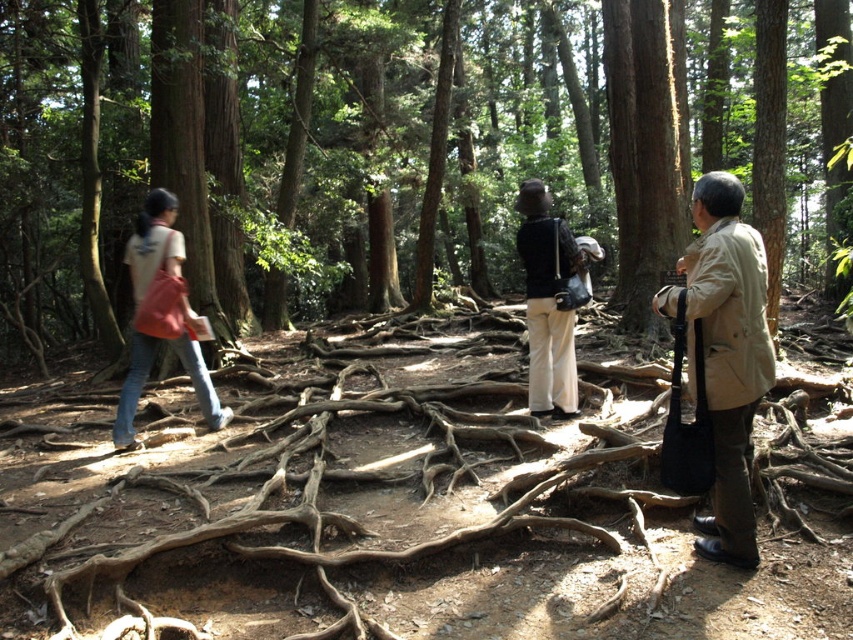
Question: Which of the following is the farthest from the observer?

Choices:
 (A) (575, 385)
 (B) (704, 538)

Answer: (A)

Question: Among these points, which one is nearest to the camera?

Choices:
 (A) (560, 364)
 (B) (717, 97)
 (C) (720, 452)
 (D) (155, 262)

Answer: (C)

Question: Does brown wood tree at center appear over beige fabric trench coat at right?

Choices:
 (A) yes
 (B) no

Answer: (A)

Question: Which object appears closest to the camera in this image?

Choices:
 (A) beige fabric trench coat at right
 (B) brown wood tree at center
 (C) matte black jacket at center

Answer: (A)

Question: Is brown wood tree at center thinner than beige fabric trench coat at right?

Choices:
 (A) no
 (B) yes

Answer: (A)

Question: Does brown wood tree at center appear on the left side of beige fabric trench coat at right?

Choices:
 (A) no
 (B) yes

Answer: (A)